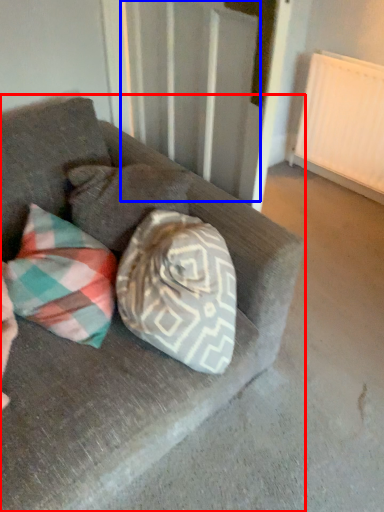
Question: Which object is closer to the camera taking this photo, studio couch (highlighted by a red box) or curtain (highlighted by a blue box)?

Choices:
 (A) studio couch
 (B) curtain

Answer: (A)